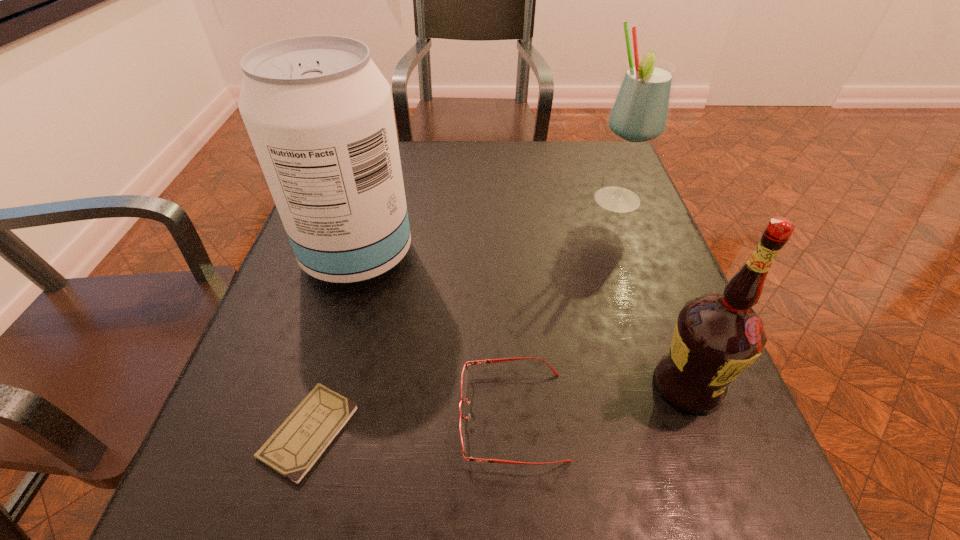
Point out which object is positioned as the nearest to the checkbook. Please provide its 2D coordinates. Your answer should be formatted as a tuple, i.e. [(x, y)], where the tuple contains the x and y coordinates of a point satisfying the conditions above.

[(464, 376)]

Locate an element on the screen. Image resolution: width=960 pixels, height=540 pixels. alcohol that is the closest to the nearest alcohol is located at coordinates (640, 111).

What are the coordinates of `alcohol that is the second closest to the shortest alcohol` in the screenshot? It's located at (319, 113).

The height and width of the screenshot is (540, 960). I want to click on free location that satisfies the following two spatial constraints: 1. on the label of the shortest alcohol; 2. on the lenses of the fourth tallest object, so click(x=699, y=415).

Identify the location of vacant space that satisfies the following two spatial constraints: 1. on the label of the nearest alcohol; 2. on the lenses of the spectacles. This screenshot has height=540, width=960. (699, 415).